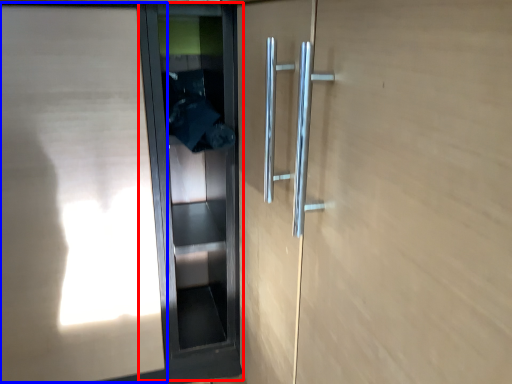
Question: Which object appears closest to the camera in this image, elevator door (highlighted by a red box) or elevator door (highlighted by a blue box)?

Choices:
 (A) elevator door
 (B) elevator door

Answer: (B)